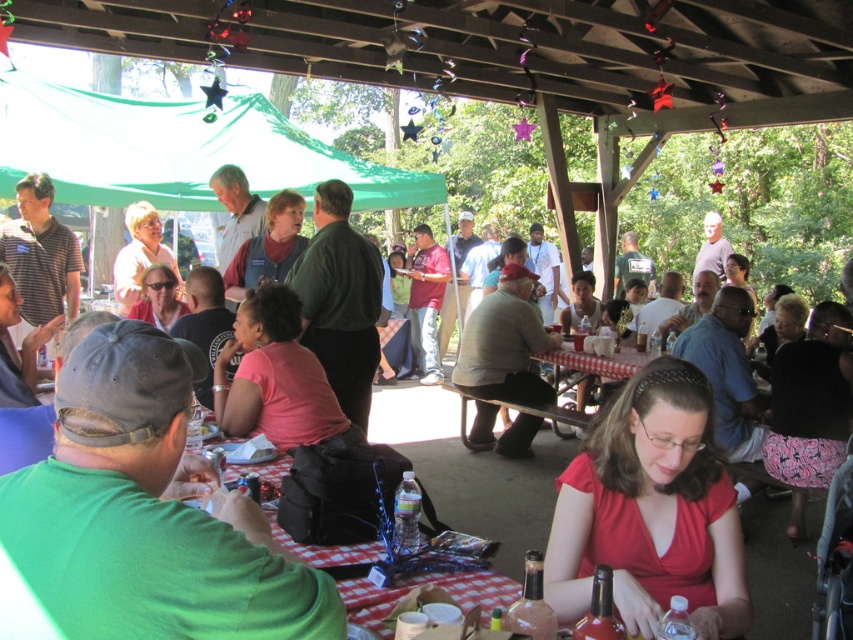
Question: Where is green matte shirt at center located in relation to red checkered tablecloth at center in the image?

Choices:
 (A) above
 (B) below

Answer: (B)

Question: Is matte red blouse at center below red checkered tablecloth at center?

Choices:
 (A) yes
 (B) no

Answer: (A)

Question: Estimate the real-world distances between objects in this image. Which object is closer to the pink fabric shirt at center?

Choices:
 (A) red checkered tablecloth at center
 (B) matte red blouse at center

Answer: (B)

Question: Which point is closer to the camera?

Choices:
 (A) green matte shirt at center
 (B) matte red blouse at center

Answer: (A)

Question: Which point is closer to the camera taking this photo?

Choices:
 (A) (547, 408)
 (B) (286, 426)
 (C) (345, 618)

Answer: (C)

Question: Is green matte shirt at center closer to camera compared to pink fabric shirt at center?

Choices:
 (A) no
 (B) yes

Answer: (B)